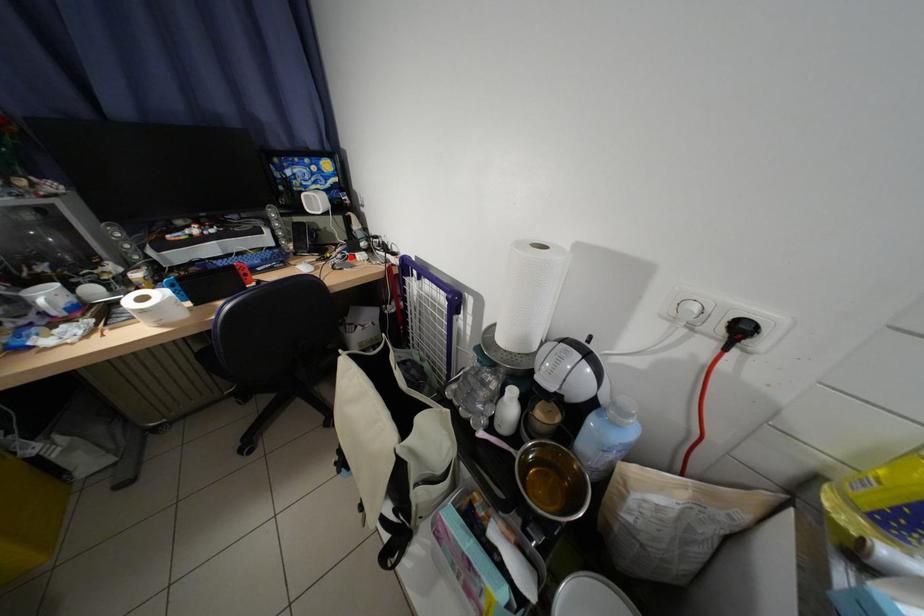
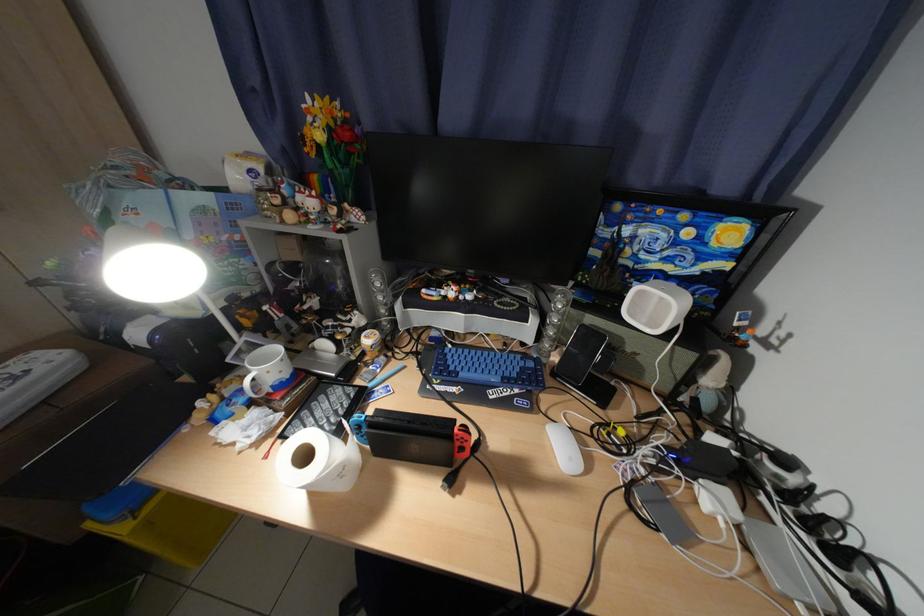
Locate, in the second image, the point that corresponds to the highlighted location in the first image.

(664, 463)